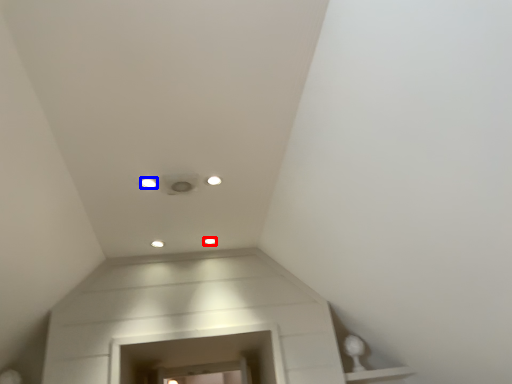
Question: Which object appears closest to the camera in this image, dot (highlighted by a red box) or dot (highlighted by a blue box)?

Choices:
 (A) dot
 (B) dot

Answer: (B)